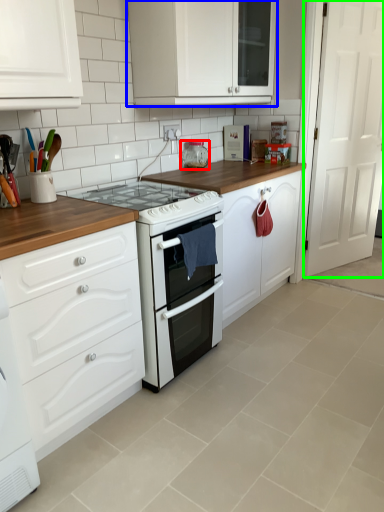
Question: Considering the real-world distances, which object is closest to appliance (highlighted by a red box)? cabinetry (highlighted by a blue box) or door (highlighted by a green box).

Choices:
 (A) cabinetry
 (B) door

Answer: (A)